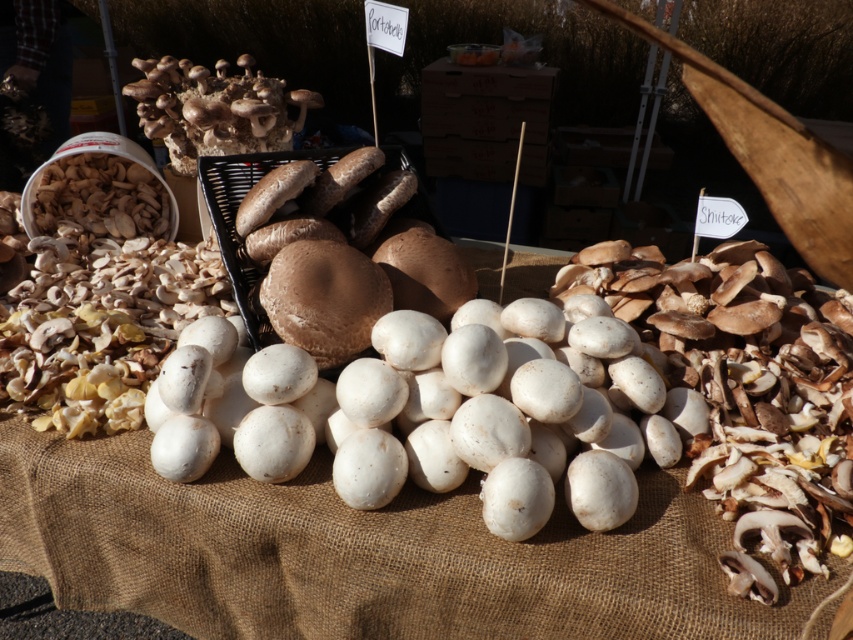
Question: Can you confirm if brown matte mushrooms at center is positioned to the right of brown fuzzy mushrooms at upper left?

Choices:
 (A) no
 (B) yes

Answer: (B)

Question: Which point appears farthest from the camera in this image?

Choices:
 (A) (183, 88)
 (B) (395, 289)

Answer: (A)

Question: Can you confirm if brown matte mushrooms at center is positioned to the left of brown fuzzy mushrooms at upper left?

Choices:
 (A) yes
 (B) no

Answer: (B)

Question: Can you confirm if brown matte mushrooms at center is wider than brown fuzzy mushrooms at upper left?

Choices:
 (A) no
 (B) yes

Answer: (A)